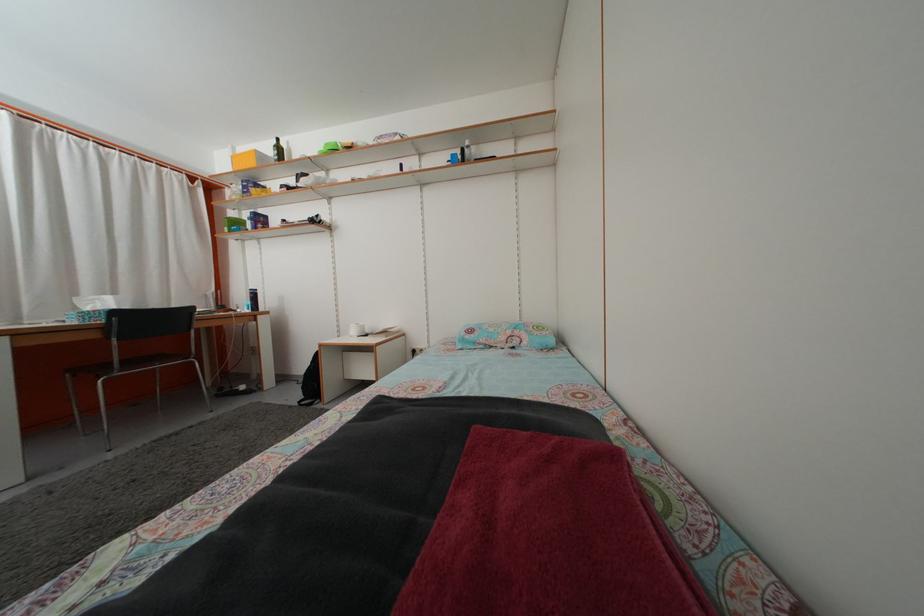
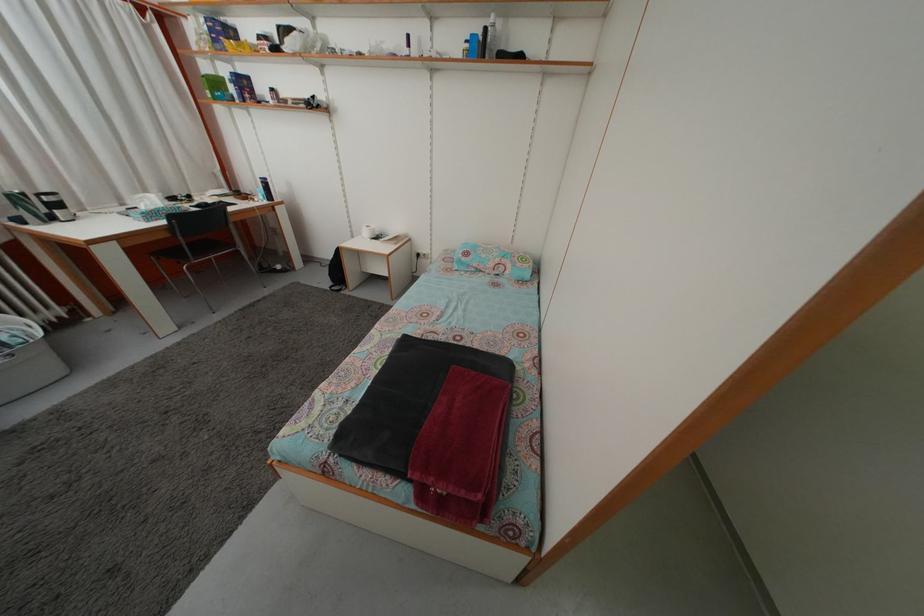
In the second image, find the point that corresponds to pixel 242 231 in the first image.

(223, 91)